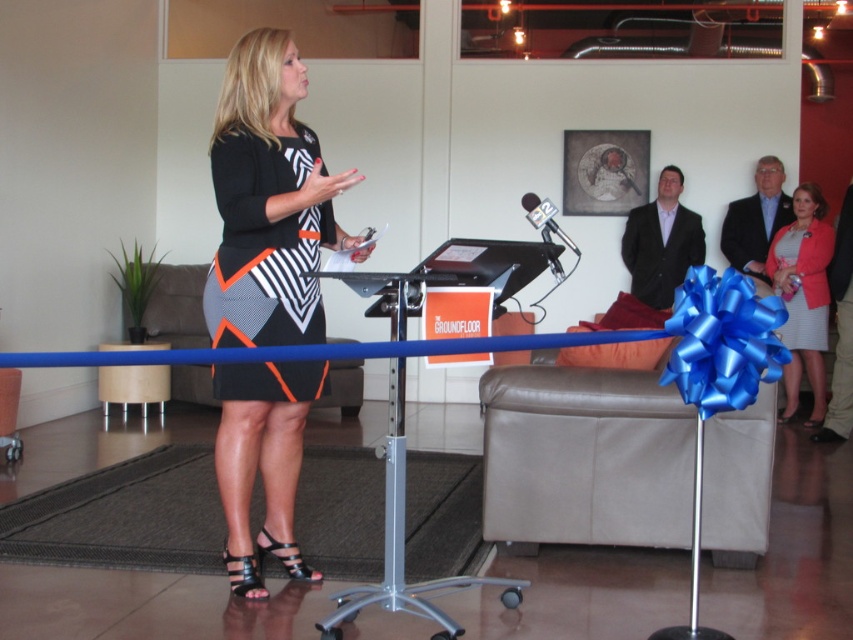
Question: Is black and white dress at center further to the viewer compared to black matte dress at center?

Choices:
 (A) yes
 (B) no

Answer: (B)

Question: Does matte pink blazer at right lie behind black metallic microphone at center?

Choices:
 (A) yes
 (B) no

Answer: (A)

Question: Which of the following is the farthest from the observer?

Choices:
 (A) black metallic microphone at center
 (B) black and white dress at center
 (C) matte black dress at right

Answer: (C)

Question: Considering the relative positions of matte pink blazer at right and matte black dress at right in the image provided, where is matte pink blazer at right located with respect to matte black dress at right?

Choices:
 (A) below
 (B) above

Answer: (A)

Question: Which point is closer to the camera taking this photo?

Choices:
 (A) (273, 369)
 (B) (276, 317)
 (C) (552, 209)
 (D) (781, 328)

Answer: (C)

Question: Estimate the real-world distances between objects in this image. Which object is farther from the matte black dress at right?

Choices:
 (A) black matte dress at center
 (B) matte pink blazer at right

Answer: (A)